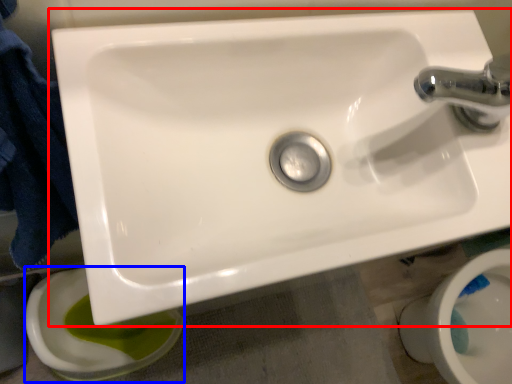
Question: Which object appears farthest to the camera in this image, sink (highlighted by a red box) or toilet bowl (highlighted by a blue box)?

Choices:
 (A) sink
 (B) toilet bowl

Answer: (B)